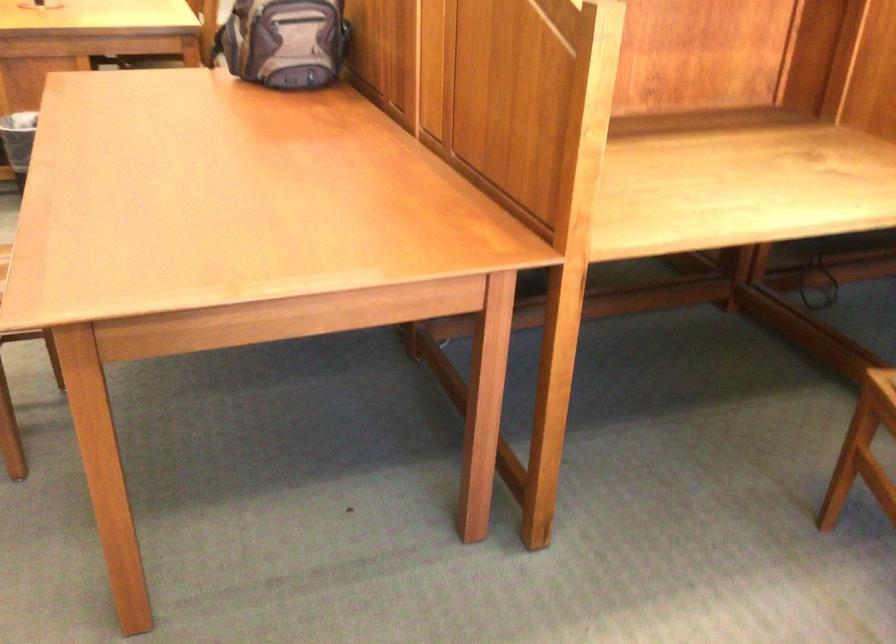
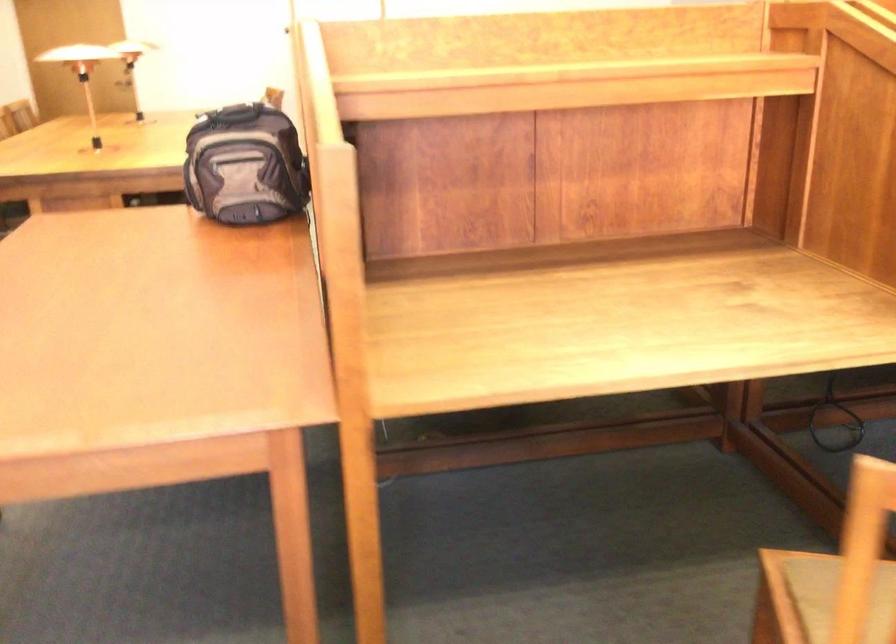
Question: In a continuous first-person perspective shot, in which direction is the camera moving?

Choices:
 (A) Left
 (B) Right
 (C) Forward
 (D) Backward

Answer: (B)